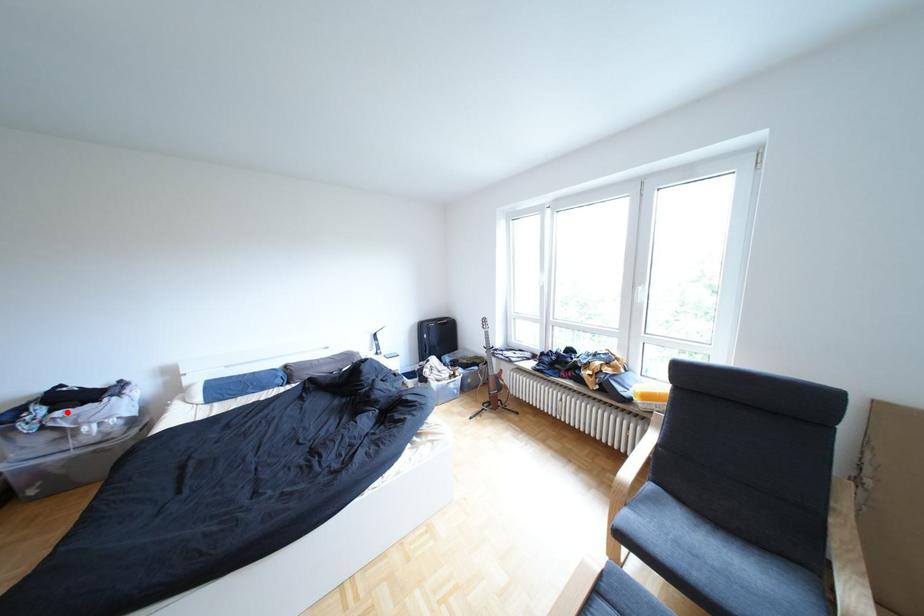
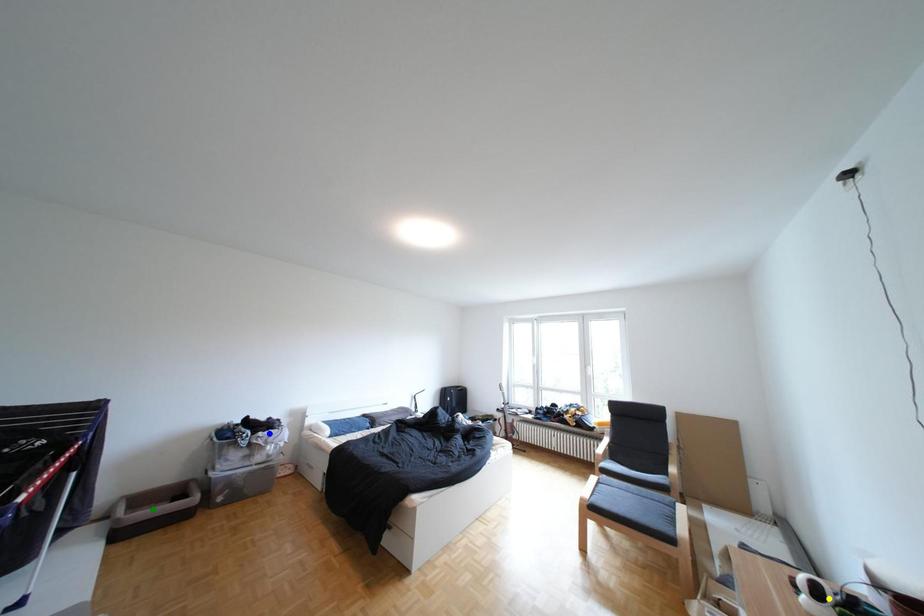
Question: I am providing you with two images of the same scene from different viewpoints. A red point is marked on the first image. You are given multiple points on the second image. Can you choose the point in image 2 that corresponds to the point in image 1?

Choices:
 (A) green point
 (B) blue point
 (C) yellow point

Answer: (B)